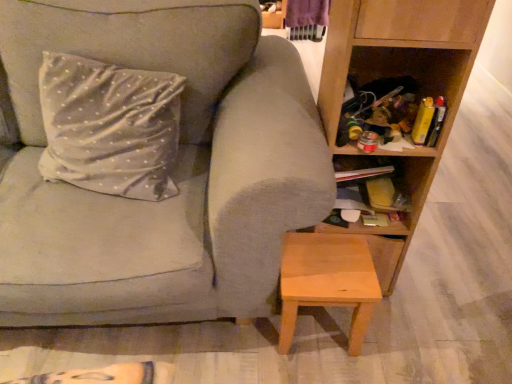
You are a GUI agent. You are given a task and a screenshot of the screen. Output one action in this format:
    pyautogui.click(x=<x>, y=<y>)
    Task: Click on the blank space situated above light brown wooden stool at lower center (from a real-world perspective)
    This screenshot has width=512, height=384.
    Given the screenshot: What is the action you would take?
    pyautogui.click(x=333, y=268)